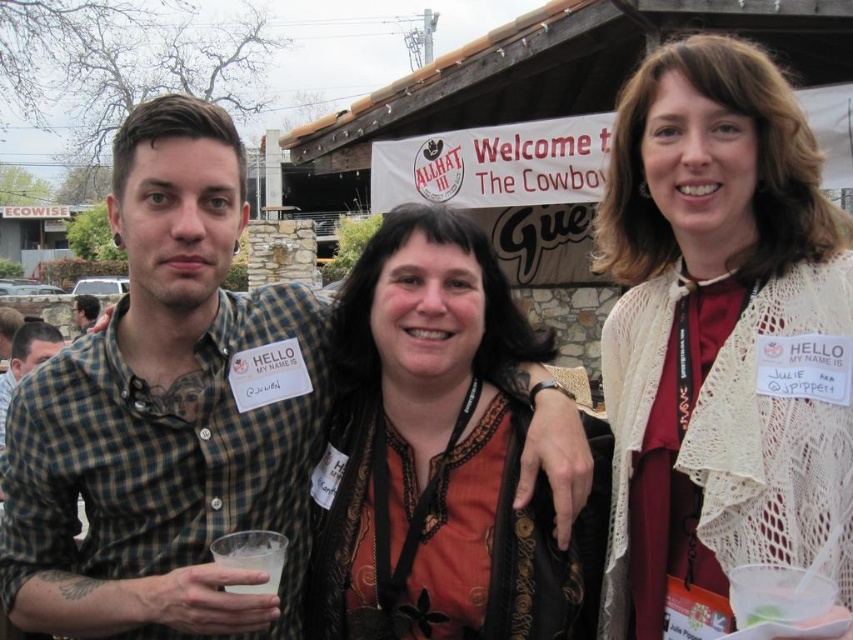
Which is in front, point (299, 310) or point (492, 291)?

Positioned in front is point (492, 291).

Can you confirm if checkered fabric shirt at center is positioned to the right of orange fabric shirt at center?

Incorrect, checkered fabric shirt at center is not on the right side of orange fabric shirt at center.

Who is more distant from viewer, (x=138, y=554) or (x=421, y=570)?

Point (x=138, y=554)

Locate an element on the screen. The height and width of the screenshot is (640, 853). checkered fabric shirt at center is located at coordinates (166, 413).

Is the position of checkered fabric shirt at center more distant than that of matte black shirt at left?

No, checkered fabric shirt at center is closer to the viewer.

Is checkered fabric shirt at center to the left of matte black shirt at left from the viewer's perspective?

Incorrect, checkered fabric shirt at center is not on the left side of matte black shirt at left.

You are a GUI agent. You are given a task and a screenshot of the screen. Output one action in this format:
    pyautogui.click(x=<x>, y=<y>)
    Task: Click on the checkered fabric shirt at center
    The image size is (853, 640).
    Given the screenshot: What is the action you would take?
    pyautogui.click(x=166, y=413)

Between white lace shawl at center and orange fabric shirt at center, which one has less height?

With less height is orange fabric shirt at center.

Based on the photo, which is more to the left, white lace shawl at center or orange fabric shirt at center?

From the viewer's perspective, orange fabric shirt at center appears more on the left side.

Between point (642, 486) and point (515, 561), which one is positioned in front?

Point (515, 561)

The width and height of the screenshot is (853, 640). I want to click on white lace shawl at center, so click(720, 340).